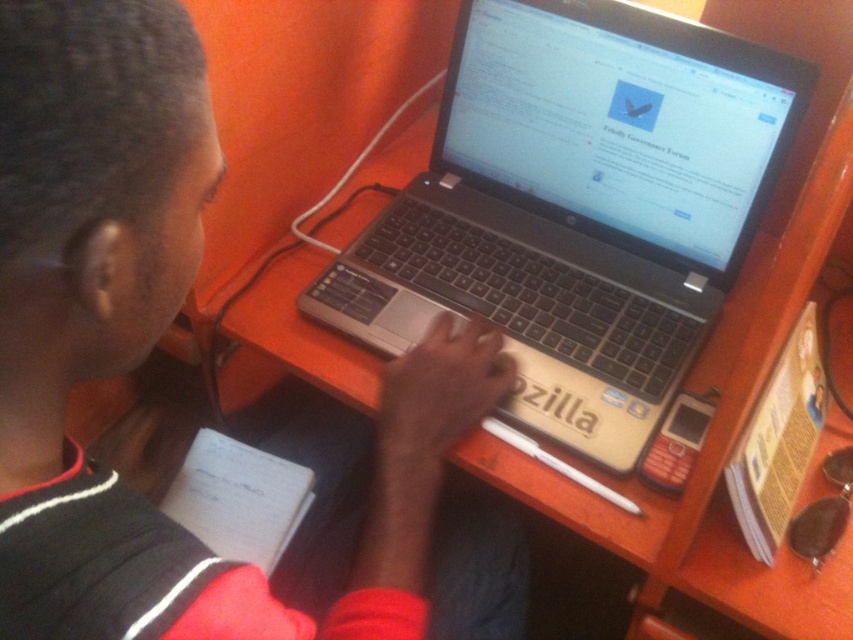
You are organizing a desk and need to place both the black matte laptop at center and the black plastic laptop at center side by side. Which one should you place on the left to ensure they fit within the desk space?

Since the black matte laptop at center is narrower than the black plastic laptop at center, you should place the black matte laptop at center on the left to accommodate both within the desk space.

You are a delivery person who just received a package containing a laptop. The package specifies that the laptop should be placed on the desk between two objects that are exactly 26 centimeters apart. You see the black matte laptop at center and the black plastic laptop at center on the desk. Can you place the new laptop between them?

The black matte laptop at center is 26.16 centimeters from the black plastic laptop at center. Since the required distance is 26 centimeters, the space between them is just slightly over the required distance. Therefore, you can place the new laptop between them as the distance is close enough.

You are organizing items on a desk and need to place a new item between the black matte laptop at center and the black plastic laptop at center. Since both are at the center, which side should you place the new item to ensure it is between them?

The black matte laptop at center is to the left of the black plastic laptop at center, so placing the new item between them would require putting it to the right of the black matte laptop at center and to the left of the black plastic laptop at center.